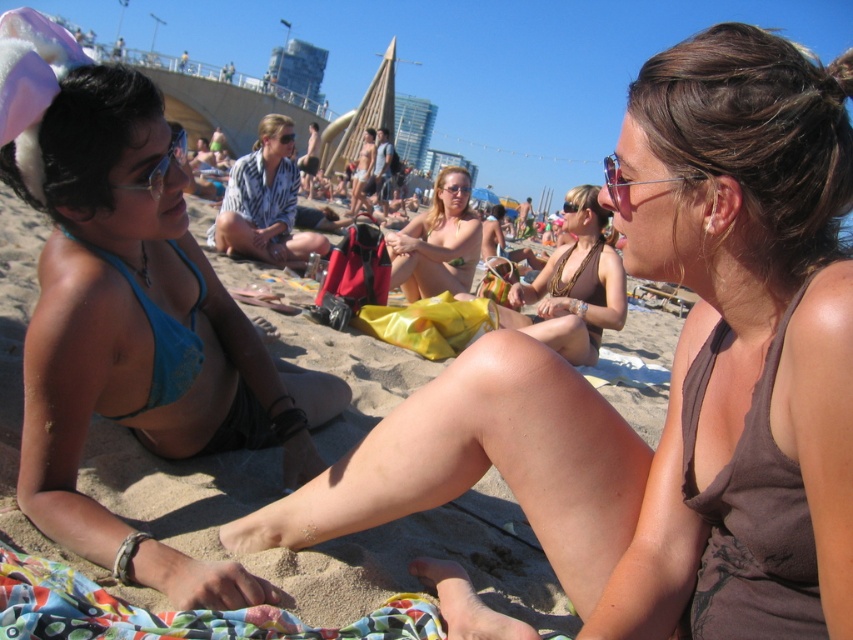
Is brown fabric bikini at right below matte skin bikini at center?

Indeed, brown fabric bikini at right is positioned under matte skin bikini at center.

Is brown fabric bikini at right wider than matte skin bikini at center?

No, brown fabric bikini at right is not wider than matte skin bikini at center.

Image resolution: width=853 pixels, height=640 pixels. Describe the element at coordinates (750, 516) in the screenshot. I see `brown fabric bikini at right` at that location.

You are a GUI agent. You are given a task and a screenshot of the screen. Output one action in this format:
    pyautogui.click(x=<x>, y=<y>)
    Task: Click on the brown fabric bikini at right
    This screenshot has width=853, height=640.
    Given the screenshot: What is the action you would take?
    pyautogui.click(x=750, y=516)

Does brown textured tank top at center come in front of printed fabric blanket at lower left?

That is True.

From the picture: Is brown textured tank top at center taller than printed fabric blanket at lower left?

Correct, brown textured tank top at center is much taller as printed fabric blanket at lower left.

Is point (775, 580) farther from viewer compared to point (404, 634)?

No, it is in front of (404, 634).

Where is `brown textured tank top at center`? brown textured tank top at center is located at coordinates (671, 376).

Between point (9, 616) and point (566, 358), which one is positioned in front?

Point (9, 616) is in front.

Between printed fabric blanket at lower left and brown textured bikini top at center, which one appears on the left side from the viewer's perspective?

From the viewer's perspective, printed fabric blanket at lower left appears more on the left side.

Does point (200, 612) come in front of point (541, 339)?

Yes, point (200, 612) is in front of point (541, 339).

Where is `printed fabric blanket at lower left`? printed fabric blanket at lower left is located at coordinates (171, 612).